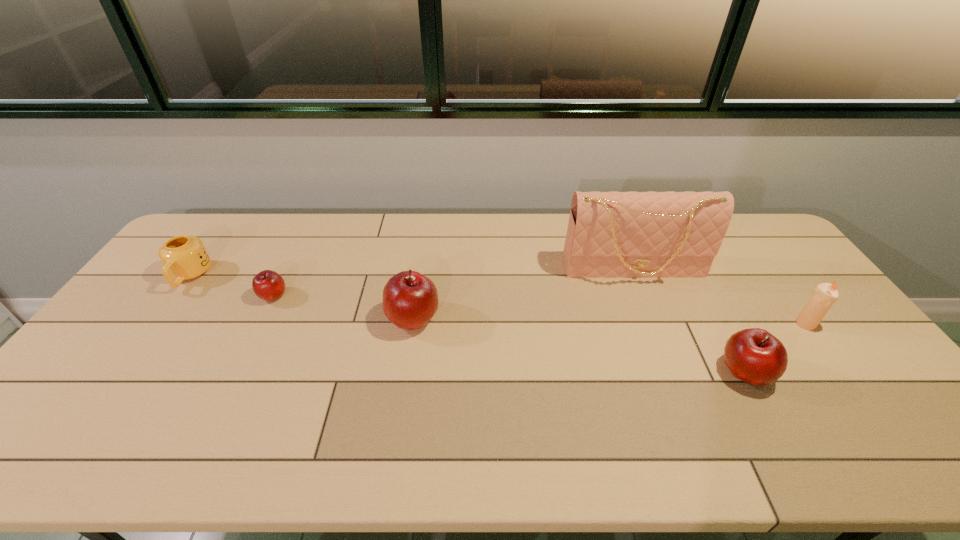
I want to click on the leftmost apple, so click(x=268, y=285).

This screenshot has height=540, width=960. What are the coordinates of `the fifth object from right to left` in the screenshot? It's located at (268, 285).

This screenshot has width=960, height=540. In order to click on the second apple from left to right in this screenshot , I will do `click(410, 299)`.

Locate an element on the screen. The image size is (960, 540). the nearest apple is located at coordinates (755, 356).

Where is `the second tallest apple`? the second tallest apple is located at coordinates (755, 356).

At what (x,y) coordinates should I click in order to perform the action: click on mug. Please return your answer as a coordinate pair (x, y). This screenshot has height=540, width=960. Looking at the image, I should click on (184, 257).

Where is `the second shortest object`? the second shortest object is located at coordinates (184, 257).

Locate an element on the screen. The height and width of the screenshot is (540, 960). candle is located at coordinates (825, 295).

Locate an element on the screen. the tallest object is located at coordinates (610, 234).

Identify the location of vacant position located 0.280m on the front of the shortest object. (228, 386).